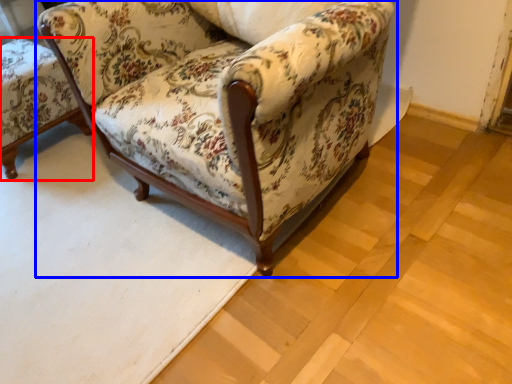
Question: Among these objects, which one is farthest to the camera, chair (highlighted by a red box) or chair (highlighted by a blue box)?

Choices:
 (A) chair
 (B) chair

Answer: (A)